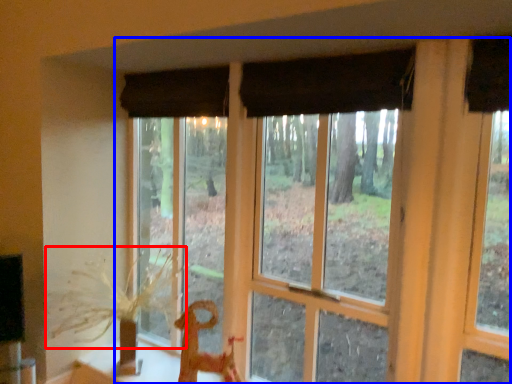
Question: Among these objects, which one is farthest to the camera, plant (highlighted by a red box) or window (highlighted by a blue box)?

Choices:
 (A) plant
 (B) window

Answer: (A)